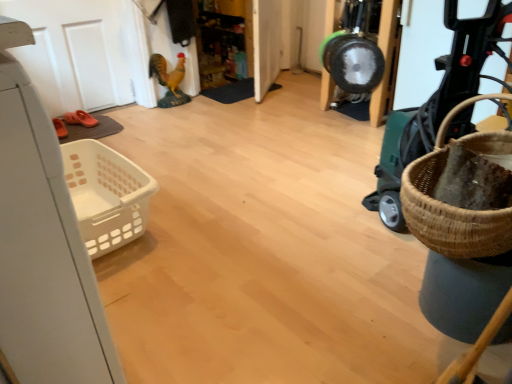
I want to click on unoccupied region to the right of orange rubber sandal at left, so click(104, 126).